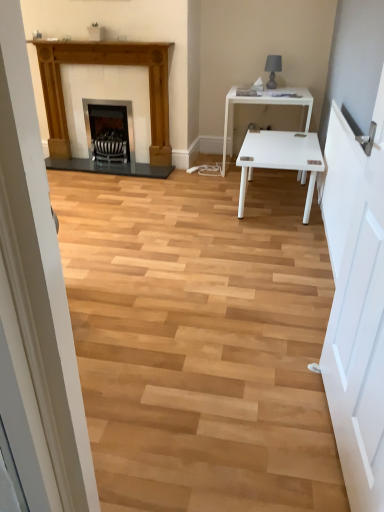
Image resolution: width=384 pixels, height=512 pixels. What do you see at coordinates (356, 303) in the screenshot?
I see `white wooden door at right` at bounding box center [356, 303].

This screenshot has height=512, width=384. What do you see at coordinates (109, 130) in the screenshot?
I see `matte black fireplace at center, which is the second fireplace from left to right` at bounding box center [109, 130].

What is the approximate height of white glossy table at center?

73.58 centimeters.

The width and height of the screenshot is (384, 512). What are the coordinates of `white glossy table at center` in the screenshot? It's located at (265, 104).

Describe the element at coordinates (105, 64) in the screenshot. I see `wooden fireplace at left, the 2th fireplace from the right` at that location.

At what (x,y) coordinates should I click in order to perform the action: click on matte black lamp at upper right. Please return your answer as a coordinate pair (x, y). This screenshot has height=512, width=384. Looking at the image, I should click on 273,69.

From the image's perspective, is wooden fireplace at left, which appears as the first fireplace when viewed from the left, located beneath matte black lamp at upper right?

Indeed, from the image's perspective, wooden fireplace at left, which appears as the first fireplace when viewed from the left, is shown beneath matte black lamp at upper right.

Is wooden fireplace at left, the 2th fireplace from the right, far from matte black lamp at upper right?

That's right, there is a large distance between wooden fireplace at left, the 2th fireplace from the right, and matte black lamp at upper right.

From a real-world perspective, is wooden fireplace at left, which appears as the first fireplace when viewed from the left, over matte black lamp at upper right?

No, from a real-world perspective, wooden fireplace at left, which appears as the first fireplace when viewed from the left, is not on top of matte black lamp at upper right.

Between wooden fireplace at left, the 2th fireplace from the right, and matte black lamp at upper right, which one has less height?

With less height is matte black lamp at upper right.

Between point (57, 69) and point (304, 88), which one is positioned behind?

The point (304, 88) is behind.

Is wooden fireplace at left, the 2th fireplace from the right, positioned with its back to white glossy table at center?

No.

How much distance is there between wooden fireplace at left, the 2th fireplace from the right, and white glossy table at center?

wooden fireplace at left, the 2th fireplace from the right, and white glossy table at center are 1.16 meters apart.

Does wooden fireplace at left, the 2th fireplace from the right, appear on the right side of white glossy table at center?

No.

Can you tell me how much matte black lamp at upper right and matte black fireplace at center, which is the second fireplace from left to right, differ in facing direction?

matte black lamp at upper right and matte black fireplace at center, which is the second fireplace from left to right, are facing 0.75 degrees away from each other.

From the image's perspective, which one is positioned higher, matte black lamp at upper right or matte black fireplace at center, which appears as the first fireplace when viewed from the right?

From the image's view, matte black lamp at upper right is above.

Based on the photo, can you confirm if matte black lamp at upper right is wider than matte black fireplace at center, which is the second fireplace from left to right?

No.

The width and height of the screenshot is (384, 512). What are the coordinates of `lamp located on the right of matte black fireplace at center, which is the second fireplace from left to right` in the screenshot? It's located at point(273,69).

Considering the relative sizes of matte black lamp at upper right and white wooden door at right in the image provided, is matte black lamp at upper right bigger than white wooden door at right?

No, matte black lamp at upper right is not bigger than white wooden door at right.

Is matte black lamp at upper right not near white wooden door at right?

matte black lamp at upper right is positioned a significant distance from white wooden door at right.

From the image's perspective, is matte black lamp at upper right above or below white wooden door at right?

Based on their image positions, matte black lamp at upper right is located above white wooden door at right.

Is point (272, 86) more distant than point (368, 508)?

That is True.

From a real-world perspective, is white glossy table at center beneath wooden fireplace at left, which appears as the first fireplace when viewed from the left?

Indeed, from a real-world perspective, white glossy table at center is positioned beneath wooden fireplace at left, which appears as the first fireplace when viewed from the left.

Identify the location of table in front of the wooden fireplace at left, the 2th fireplace from the right. Image resolution: width=384 pixels, height=512 pixels. (265, 104).

Does point (280, 100) lie in front of point (48, 99)?

Yes, it is in front of point (48, 99).

Which object is positioned more to the left, white glossy table at center or wooden fireplace at left, which appears as the first fireplace when viewed from the left?

From the viewer's perspective, wooden fireplace at left, which appears as the first fireplace when viewed from the left, appears more on the left side.

From a real-world perspective, which object stands above the other?

From a 3D spatial view, matte black lamp at upper right is above.

How different are the orientations of matte black lamp at upper right and white glossy table at center in degrees?

The angular difference between matte black lamp at upper right and white glossy table at center is 2.24 degrees.

Could you tell me if matte black lamp at upper right is turned towards white glossy table at center?

No, matte black lamp at upper right is not facing towards white glossy table at center.

Are matte black lamp at upper right and white glossy table at center located far from each other?

No, matte black lamp at upper right is not far away from white glossy table at center.

Where is `table below the white wooden door at right (from a real-world perspective)`? The height and width of the screenshot is (512, 384). table below the white wooden door at right (from a real-world perspective) is located at coordinates (265, 104).

Is white wooden door at right directly adjacent to white glossy table at center?

No, white wooden door at right is not in contact with white glossy table at center.

How far apart are white wooden door at right and white glossy table at center?

white wooden door at right is 7.16 feet from white glossy table at center.

Which object is positioned more to the right, white wooden door at right or white glossy table at center?

white glossy table at center is more to the right.

Locate an element on the screen. lamp lying on the right of wooden fireplace at left, which appears as the first fireplace when viewed from the left is located at coordinates (273, 69).

Which fireplace is the 1st one when counting from the back of the white glossy table at center? Please provide its 2D coordinates.

[(105, 64)]

Estimate the real-world distances between objects in this image. Which object is closer to wooden fireplace at left, the 2th fireplace from the right, matte black lamp at upper right or white glossy table at center?

white glossy table at center is closer to wooden fireplace at left, the 2th fireplace from the right.

Considering their positions, is matte black fireplace at center, which is the second fireplace from left to right, positioned further to white glossy table at center than white wooden door at right?

white wooden door at right is further to white glossy table at center.

Looking at the image, which one is located further to wooden fireplace at left, the 2th fireplace from the right, white wooden door at right or white glossy table at center?

white wooden door at right lies further to wooden fireplace at left, the 2th fireplace from the right, than the other object.

When comparing their distances from matte black lamp at upper right, does white wooden door at right or wooden fireplace at left, the 2th fireplace from the right, seem further?

white wooden door at right is positioned further to the anchor matte black lamp at upper right.

Which object lies further to the anchor point matte black fireplace at center, which is the second fireplace from left to right, wooden fireplace at left, the 2th fireplace from the right, or white glossy table at center?

white glossy table at center lies further to matte black fireplace at center, which is the second fireplace from left to right, than the other object.

From the picture: Based on their spatial positions, is white glossy table at center or matte black lamp at upper right closer to matte black fireplace at center, which appears as the first fireplace when viewed from the right?

white glossy table at center.

Which object lies nearer to the anchor point wooden fireplace at left, the 2th fireplace from the right, matte black lamp at upper right or matte black fireplace at center, which appears as the first fireplace when viewed from the right?

The object closer to wooden fireplace at left, the 2th fireplace from the right, is matte black fireplace at center, which appears as the first fireplace when viewed from the right.

Considering their positions, is white glossy table at center positioned further to matte black fireplace at center, which appears as the first fireplace when viewed from the right, than white wooden door at right?

white wooden door at right lies further to matte black fireplace at center, which appears as the first fireplace when viewed from the right, than the other object.

Where is `table between white wooden door at right and matte black lamp at upper right in the front-back direction`? table between white wooden door at right and matte black lamp at upper right in the front-back direction is located at coordinates (265, 104).

What are the coordinates of `table between white wooden door at right and wooden fireplace at left, the 2th fireplace from the right, along the z-axis` in the screenshot? It's located at coord(265,104).

Where is `table between white wooden door at right and matte black fireplace at center, which appears as the first fireplace when viewed from the right, along the z-axis`? table between white wooden door at right and matte black fireplace at center, which appears as the first fireplace when viewed from the right, along the z-axis is located at coordinates (265, 104).

Find the location of a particular element. The width and height of the screenshot is (384, 512). lamp located between white wooden door at right and matte black fireplace at center, which appears as the first fireplace when viewed from the right, in the depth direction is located at coordinates click(x=273, y=69).